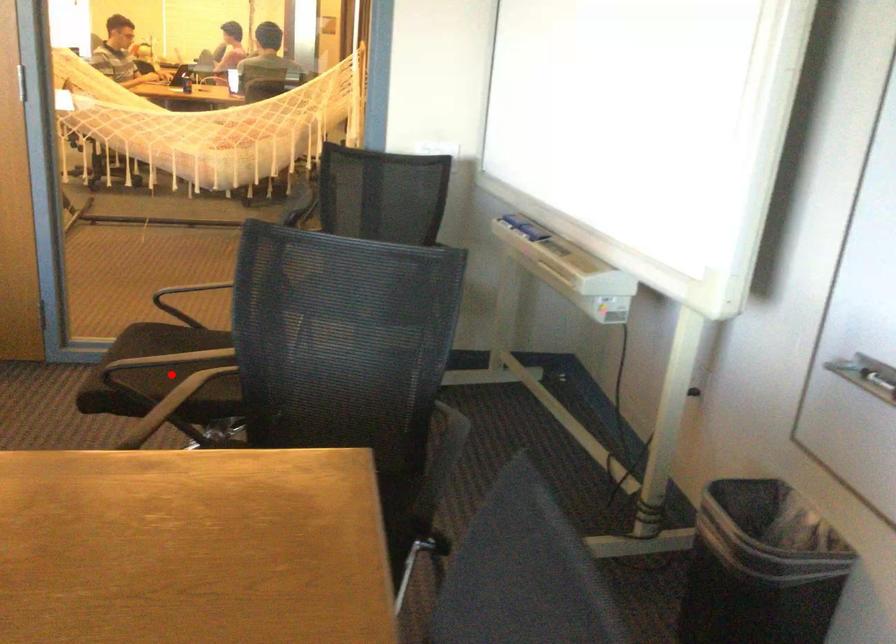
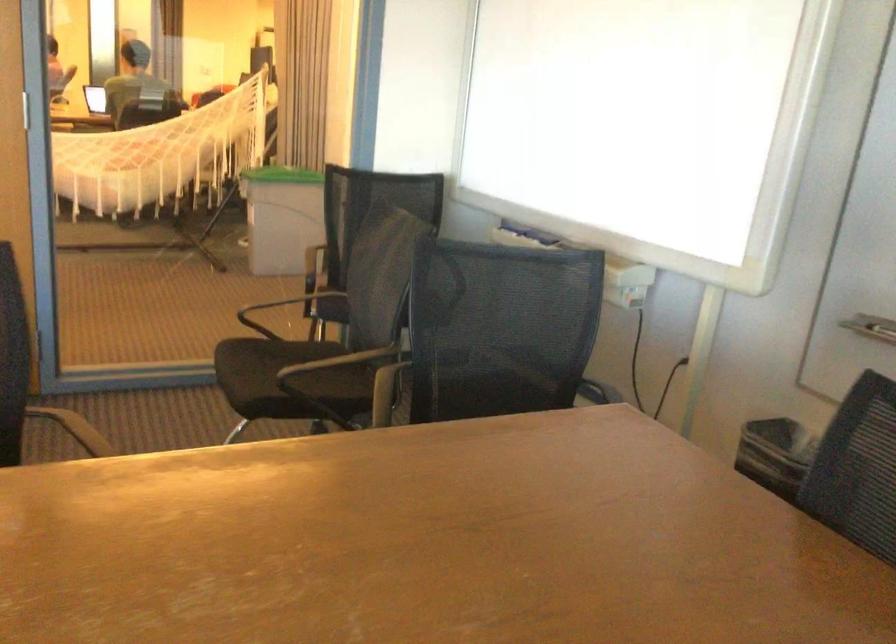
Where in the second image is the point corresponding to the highlighted location from the first image?

(288, 379)